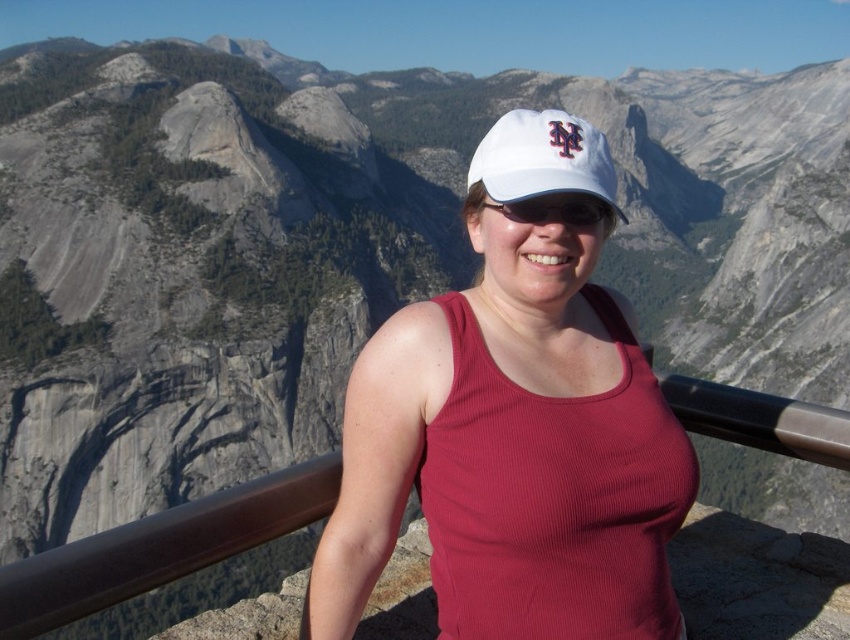
You are a photographer trying to capture the scenic overlook with the person wearing the white matte baseball cap at center and the white fabric cap at center. Which cap is located lower in the image?

The white matte baseball cap at center is positioned under the white fabric cap at center, so it is lower in the image.

You are a photographer trying to capture the scenic overlook. You notice the white matte baseball cap at center in the image. Based on its position, can you determine if it is closer to the foreground or background of the scene?

The white matte baseball cap at center is located at point coordinates that place it in the foreground, as it is positioned near the metal railing where the person is standing, which is typically closer to the viewer in such scenes.